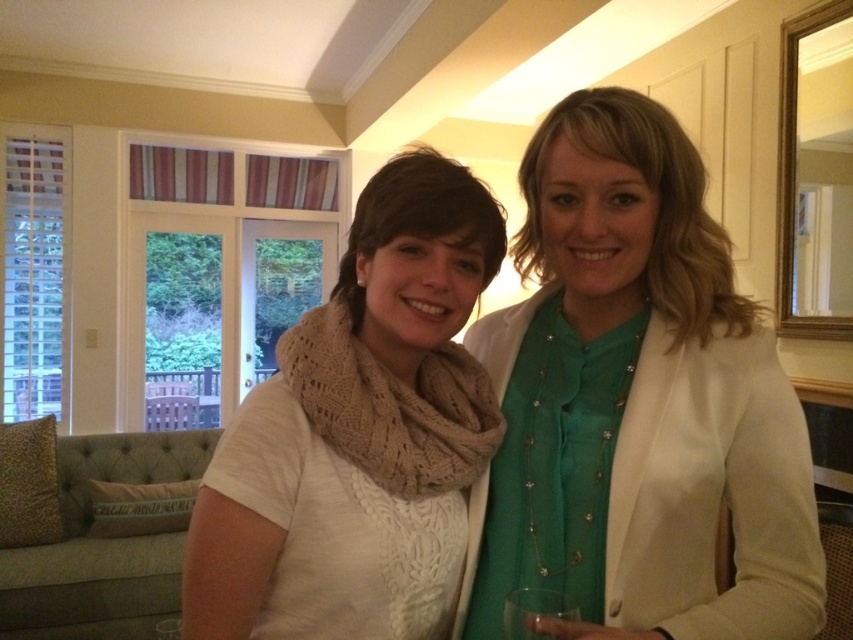
You are a fashion designer observing two scarves in the image. The white knit scarf at center and the knit beige scarf at center. Which one has a greater width?

The white knit scarf at center has a greater width than the knit beige scarf at center.

You are a photographer setting up a shoot in this living room. You want to ensure that both the matte white blazer at center and the knit beige scarf at center are visible in the frame. Given their positions, which item might partially obscure the other?

The matte white blazer at center is in front of the knit beige scarf at center, so the matte white blazer at center might partially obscure the knit beige scarf at center.